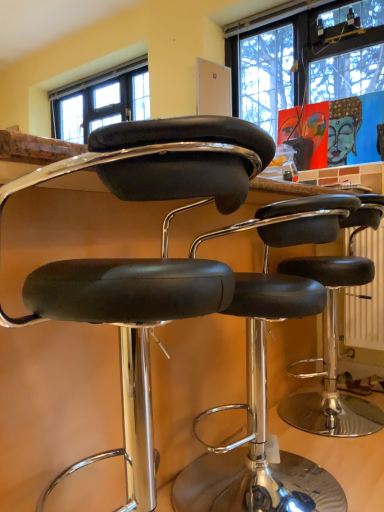
You are a GUI agent. You are given a task and a screenshot of the screen. Output one action in this format:
    pyautogui.click(x=<x>, y=<y>)
    Task: Click on the black leather stool at center, the 1th chair viewed from the back
    The height and width of the screenshot is (512, 384).
    Given the screenshot: What is the action you would take?
    pyautogui.click(x=263, y=402)

What do you see at coordinates (263, 402) in the screenshot? Image resolution: width=384 pixels, height=512 pixels. I see `black leather stool at center, which is the second chair in front-to-back order` at bounding box center [263, 402].

You are a GUI agent. You are given a task and a screenshot of the screen. Output one action in this format:
    pyautogui.click(x=<x>, y=<y>)
    Task: Click on the black leather stool at center, which is the 1th chair from front to back
    This screenshot has width=384, height=512.
    Given the screenshot: What is the action you would take?
    pyautogui.click(x=145, y=259)

This screenshot has width=384, height=512. Describe the element at coordinates (145, 259) in the screenshot. I see `black leather stool at center, which is the 1th chair from front to back` at that location.

Measure the distance between black leather stool at center, which is the 1th chair from front to back, and camera.

black leather stool at center, which is the 1th chair from front to back, and camera are 20.59 inches apart from each other.

Locate an element on the screen. This screenshot has height=512, width=384. black leather stool at center, which is the second chair in front-to-back order is located at coordinates (263, 402).

Considering the positions of objects black leather stool at center, which is counted as the second chair, starting from the back, and black leather stool at center, the 1th chair viewed from the back, in the image provided, who is more to the right, black leather stool at center, which is counted as the second chair, starting from the back, or black leather stool at center, the 1th chair viewed from the back,?

From the viewer's perspective, black leather stool at center, the 1th chair viewed from the back, appears more on the right side.

Considering the positions of objects black leather stool at center, which is the 1th chair from front to back, and black leather stool at center, the 1th chair viewed from the back, in the image provided, who is behind, black leather stool at center, which is the 1th chair from front to back, or black leather stool at center, the 1th chair viewed from the back,?

black leather stool at center, the 1th chair viewed from the back.

Which is closer to the camera, (157, 313) or (225, 465)?

Point (157, 313) appears to be closer to the viewer than point (225, 465).

From the image's perspective, is black leather stool at center, which is counted as the second chair, starting from the back, positioned above or below black leather stool at center, which is the second chair in front-to-back order?

Clearly, from the image's perspective, black leather stool at center, which is counted as the second chair, starting from the back, is above black leather stool at center, which is the second chair in front-to-back order.

From a real-world perspective, who is located lower, black leather stool at center, which is counted as the second chair, starting from the back, or black leather stool at center, which is the second chair in front-to-back order?

black leather stool at center, which is the second chair in front-to-back order.

Which of these two, black leather stool at center, which is the 1th chair from front to back, or black leather stool at center, the 1th chair viewed from the back, is thinner?

With smaller width is black leather stool at center, which is the 1th chair from front to back.

Considering the relative sizes of black leather stool at center, which is counted as the second chair, starting from the back, and black leather stool at center, which is the second chair in front-to-back order, in the image provided, is black leather stool at center, which is counted as the second chair, starting from the back, taller than black leather stool at center, which is the second chair in front-to-back order,?

Indeed, black leather stool at center, which is counted as the second chair, starting from the back, has a greater height compared to black leather stool at center, which is the second chair in front-to-back order.

Is black leather stool at center, which is counted as the second chair, starting from the back, smaller than black leather stool at center, which is the second chair in front-to-back order?

Actually, black leather stool at center, which is counted as the second chair, starting from the back, might be larger than black leather stool at center, which is the second chair in front-to-back order.

Can black leather stool at center, which is the second chair in front-to-back order, be found inside black leather stool at center, which is the 1th chair from front to back?

No, black leather stool at center, which is the second chair in front-to-back order, is not inside black leather stool at center, which is the 1th chair from front to back.

Does black leather stool at center, which is the 1th chair from front to back, touch black leather stool at center, the 1th chair viewed from the back?

black leather stool at center, which is the 1th chair from front to back, is not next to black leather stool at center, the 1th chair viewed from the back, and they're not touching.

Is black leather stool at center, which is counted as the second chair, starting from the back, facing away from black leather stool at center, the 1th chair viewed from the back?

No, black leather stool at center, which is counted as the second chair, starting from the back, is not facing away from black leather stool at center, the 1th chair viewed from the back.

How many degrees apart are the facing directions of black leather stool at center, which is the 1th chair from front to back, and black leather stool at center, the 1th chair viewed from the back?

They differ by 0.000171 degrees in their facing directions.

How distant is black leather stool at center, which is the 1th chair from front to back, from black leather stool at center, which is the second chair in front-to-back order?

A distance of 12.65 inches exists between black leather stool at center, which is the 1th chair from front to back, and black leather stool at center, which is the second chair in front-to-back order.

Where is `chair that is above the black leather stool at center, which is the second chair in front-to-back order (from a real-world perspective)`? chair that is above the black leather stool at center, which is the second chair in front-to-back order (from a real-world perspective) is located at coordinates (145, 259).

Considering the positions of objects black leather stool at center, the 1th chair viewed from the back, and black leather stool at center, which is counted as the second chair, starting from the back, in the image provided, who is more to the left, black leather stool at center, the 1th chair viewed from the back, or black leather stool at center, which is counted as the second chair, starting from the back,?

From the viewer's perspective, black leather stool at center, which is counted as the second chair, starting from the back, appears more on the left side.

In the image, is black leather stool at center, which is the second chair in front-to-back order, positioned in front of or behind black leather stool at center, which is the 1th chair from front to back?

In the image, black leather stool at center, which is the second chair in front-to-back order, appears behind black leather stool at center, which is the 1th chair from front to back.

Is point (248, 454) positioned before point (96, 158)?

No, it is behind (96, 158).

From the image's perspective, which object appears higher, black leather stool at center, the 1th chair viewed from the back, or black leather stool at center, which is the 1th chair from front to back?

black leather stool at center, which is the 1th chair from front to back, is shown above in the image.

From a real-world perspective, is black leather stool at center, the 1th chair viewed from the back, physically above black leather stool at center, which is the 1th chair from front to back?

No, from a real-world perspective, black leather stool at center, the 1th chair viewed from the back, is not over black leather stool at center, which is the 1th chair from front to back

Can you confirm if black leather stool at center, which is the second chair in front-to-back order, is wider than black leather stool at center, which is counted as the second chair, starting from the back?

Indeed, black leather stool at center, which is the second chair in front-to-back order, has a greater width compared to black leather stool at center, which is counted as the second chair, starting from the back.

Between black leather stool at center, which is the second chair in front-to-back order, and black leather stool at center, which is counted as the second chair, starting from the back, which one has more height?

black leather stool at center, which is counted as the second chair, starting from the back.

Between black leather stool at center, the 1th chair viewed from the back, and black leather stool at center, which is the 1th chair from front to back, which one has larger size?

Bigger between the two is black leather stool at center, which is the 1th chair from front to back.

Can we say black leather stool at center, which is the second chair in front-to-back order, lies outside black leather stool at center, which is counted as the second chair, starting from the back?

Yes, black leather stool at center, which is the second chair in front-to-back order, is not within black leather stool at center, which is counted as the second chair, starting from the back.

Is black leather stool at center, the 1th chair viewed from the back, positioned far away from black leather stool at center, which is the 1th chair from front to back?

No, there isn't a large distance between black leather stool at center, the 1th chair viewed from the back, and black leather stool at center, which is the 1th chair from front to back.

Could you tell me if black leather stool at center, which is the second chair in front-to-back order, is turned towards black leather stool at center, which is counted as the second chair, starting from the back?

No.

Locate an element on the screen. The height and width of the screenshot is (512, 384). chair lying behind the black leather stool at center, which is the 1th chair from front to back is located at coordinates (263, 402).

You are a GUI agent. You are given a task and a screenshot of the screen. Output one action in this format:
    pyautogui.click(x=<x>, y=<y>)
    Task: Click on the chair located in front of the black leather stool at center, which is the second chair in front-to-back order
    
    Given the screenshot: What is the action you would take?
    pyautogui.click(x=145, y=259)

Find the location of `chair located behind the black leather stool at center, which is counted as the second chair, starting from the back`. chair located behind the black leather stool at center, which is counted as the second chair, starting from the back is located at coordinates (263, 402).